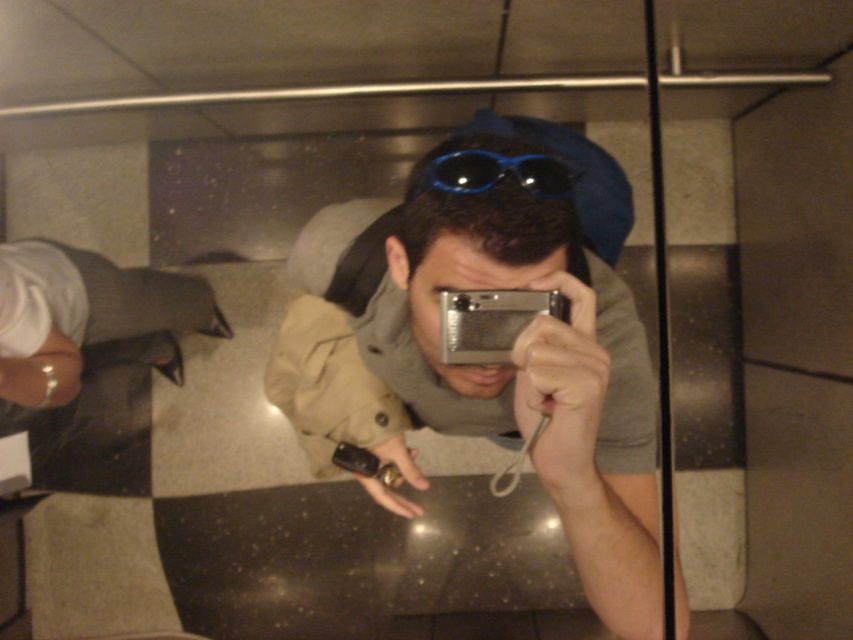
Question: Among these objects, which one is nearest to the camera?

Choices:
 (A) silver metallic camera at center
 (B) blue plastic goggles at center

Answer: (A)

Question: From the image, what is the correct spatial relationship of silver metallic camera at center in relation to blue plastic goggles at center?

Choices:
 (A) right
 (B) left

Answer: (A)

Question: Where is silver metallic camera at center located in relation to blue plastic goggles at center in the image?

Choices:
 (A) below
 (B) above

Answer: (A)

Question: Among these points, which one is nearest to the camera?

Choices:
 (A) (422, 164)
 (B) (648, 627)

Answer: (A)

Question: Does silver metallic camera at center have a lesser width compared to blue plastic goggles at center?

Choices:
 (A) yes
 (B) no

Answer: (B)